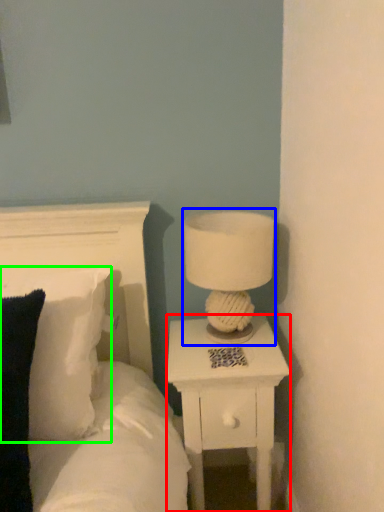
Question: Based on their relative distances, which object is farther from nightstand (highlighted by a red box)? Choose from table lamp (highlighted by a blue box) and pillow (highlighted by a green box).

Choices:
 (A) table lamp
 (B) pillow

Answer: (B)